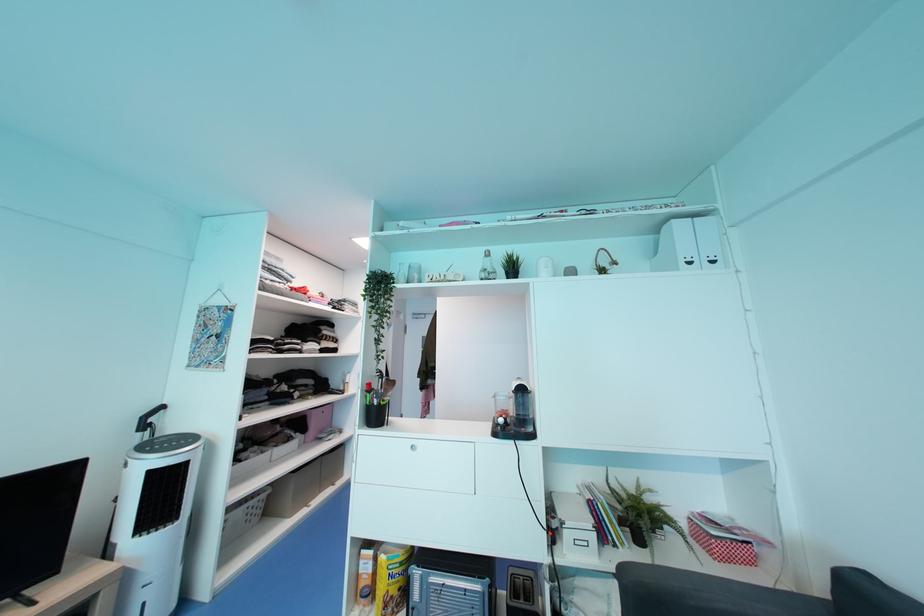
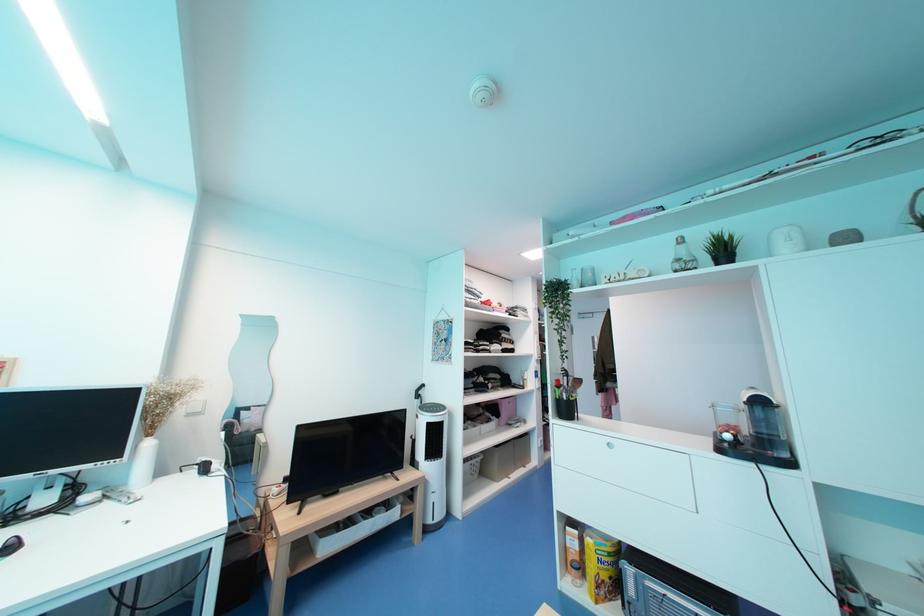
Question: The images are taken continuously from a first-person perspective. In which direction is your viewpoint rotating?

Choices:
 (A) Left
 (B) Right
 (C) Up
 (D) Down

Answer: (A)